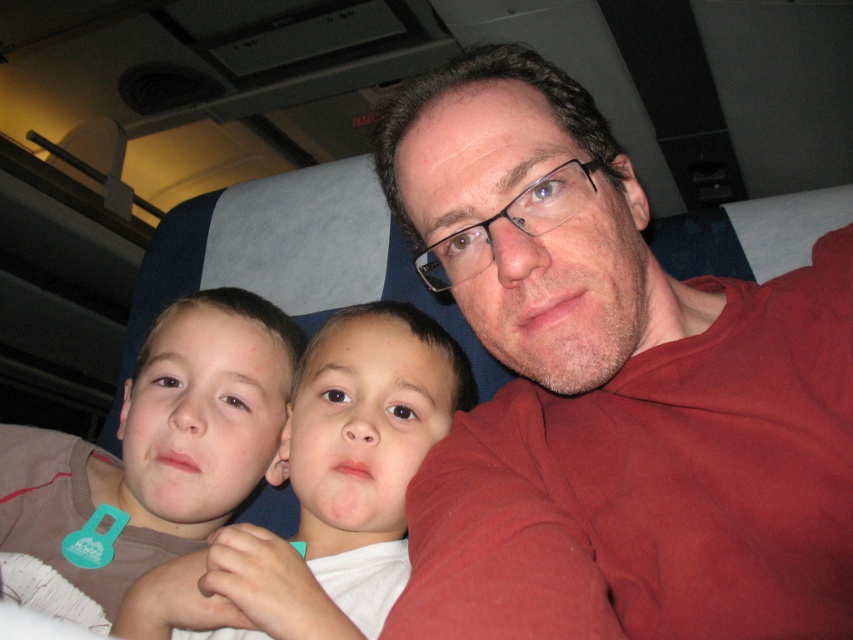
This screenshot has width=853, height=640. In order to click on brown fabric shirt at left in this screenshot , I will do `click(158, 445)`.

Between point (231, 316) and point (306, 484), which one is positioned in front?

Point (306, 484) is more forward.

At what (x,y) coordinates should I click in order to perform the action: click on brown fabric shirt at left. Please return your answer as a coordinate pair (x, y). The image size is (853, 640). Looking at the image, I should click on (158, 445).

Can you confirm if matte red shirt at center is wider than brown cotton shirt at left?

Yes, matte red shirt at center is wider than brown cotton shirt at left.

Does matte red shirt at center lie behind brown cotton shirt at left?

No, it is in front of brown cotton shirt at left.

Does point (660, 490) come in front of point (347, 515)?

Yes, it is in front of point (347, 515).

Locate an element on the screen. The height and width of the screenshot is (640, 853). matte red shirt at center is located at coordinates (612, 390).

Which is above, matte red shirt at center or brown fabric shirt at left?

Positioned higher is matte red shirt at center.

Can you confirm if matte red shirt at center is shorter than brown fabric shirt at left?

In fact, matte red shirt at center may be taller than brown fabric shirt at left.

Locate an element on the screen. matte red shirt at center is located at coordinates (612, 390).